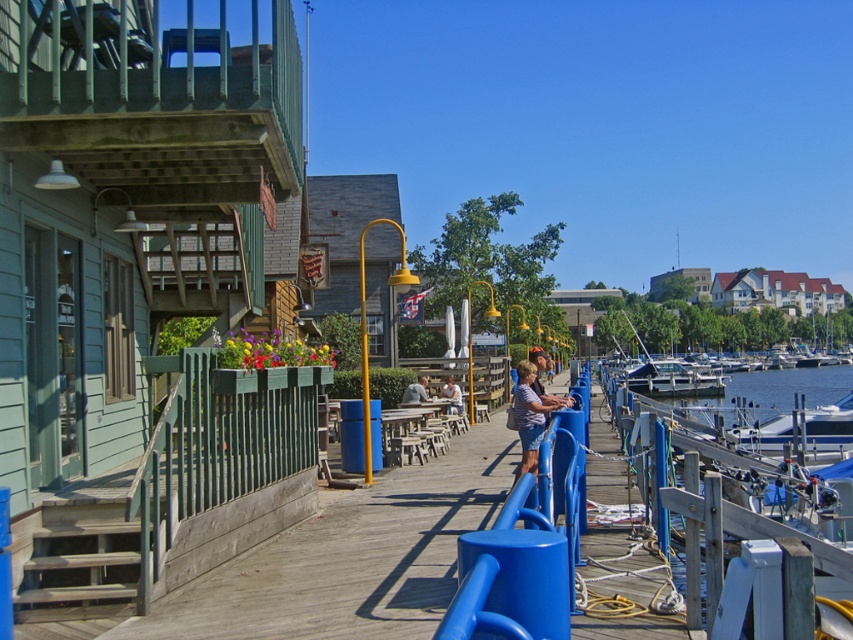
Question: Does white glossy boat at right appear on the left side of blue denim shorts at right?

Choices:
 (A) yes
 (B) no

Answer: (B)

Question: Which point is farther to the camera?

Choices:
 (A) white glossy boat at right
 (B) light blue shirt at center
 (C) blue denim shorts at right

Answer: (B)

Question: Where is white glossy boat at right located in relation to white fiberglass boat at right in the image?

Choices:
 (A) right
 (B) left

Answer: (B)

Question: Among these points, which one is nearest to the camera?

Choices:
 (A) (531, 445)
 (B) (840, 426)
 (C) (695, 381)

Answer: (A)

Question: Which object is the closest to the blue denim shorts at right?

Choices:
 (A) light blue shirt at center
 (B) white glossy boat at right

Answer: (A)

Question: Is white glossy boat at right in front of blue denim shorts at right?

Choices:
 (A) yes
 (B) no

Answer: (B)